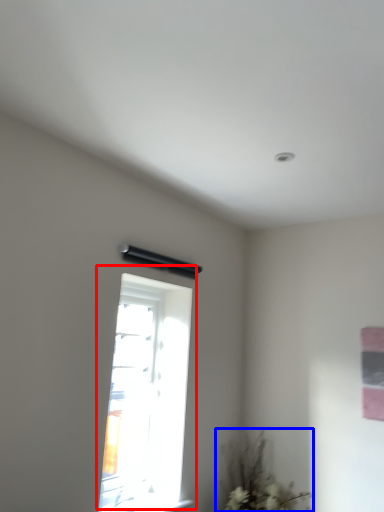
Question: Which object is further to the camera taking this photo, window (highlighted by a red box) or plant (highlighted by a blue box)?

Choices:
 (A) window
 (B) plant

Answer: (B)